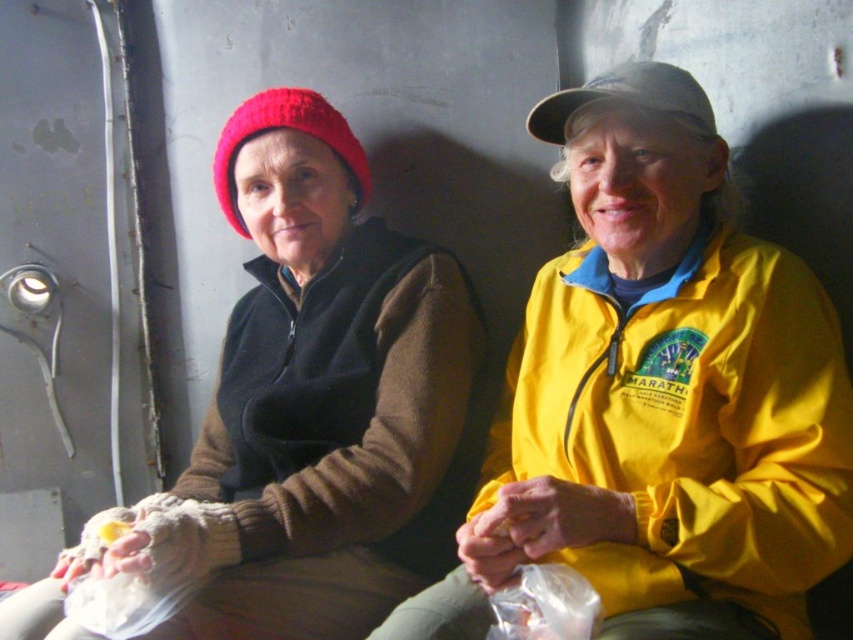
Is yellow matte jacket at center below knitted woolen beanie at upper left?

Yes.

Does point (726, 284) come closer to viewer compared to point (316, 99)?

Yes, it is in front of point (316, 99).

Where is `yellow matte jacket at center`? yellow matte jacket at center is located at coordinates (659, 396).

Between point (254, 124) and point (102, 525), which one is positioned behind?

The point (254, 124) is more distant.

Does knitted woolen beanie at upper left have a smaller size compared to yellow soft bread at lower left?

Incorrect, knitted woolen beanie at upper left is not smaller in size than yellow soft bread at lower left.

Is point (325, 115) positioned in front of point (102, 541)?

No, it is behind (102, 541).

Where is `knitted woolen beanie at upper left`? This screenshot has height=640, width=853. knitted woolen beanie at upper left is located at coordinates (285, 129).

Does knitted woolen beanie at upper left have a greater width compared to camouflage fabric cap at upper right?

Yes.

Does knitted woolen beanie at upper left have a lesser width compared to camouflage fabric cap at upper right?

No.

You are a GUI agent. You are given a task and a screenshot of the screen. Output one action in this format:
    pyautogui.click(x=<x>, y=<y>)
    Task: Click on the knitted woolen beanie at upper left
    Image resolution: width=853 pixels, height=640 pixels.
    Given the screenshot: What is the action you would take?
    pyautogui.click(x=285, y=129)